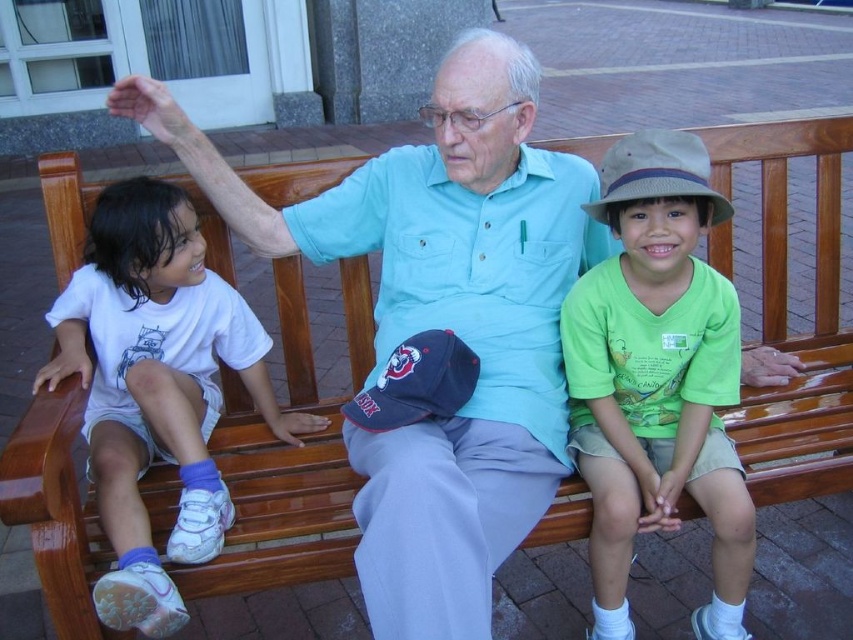
You are a photographer standing 50 inches away from the bench. You want to take a picture of the green cotton shirt at center and the white cotton shirt at left. Can you fit both shirts into the frame of your camera, which has a maximum width of 40 inches?

The green cotton shirt at center is 35.46 inches away from the white cotton shirt at left. Since the distance between them is less than the camera frame width of 40 inches, both shirts can fit into the frame.

You are standing at the center of the park and want to find the green cotton shirt at center. According to the coordinates given, in which direction should you look to locate it?

The green cotton shirt at center is located at coordinates point (x=657, y=378), so you should look towards the center of the park to find it.